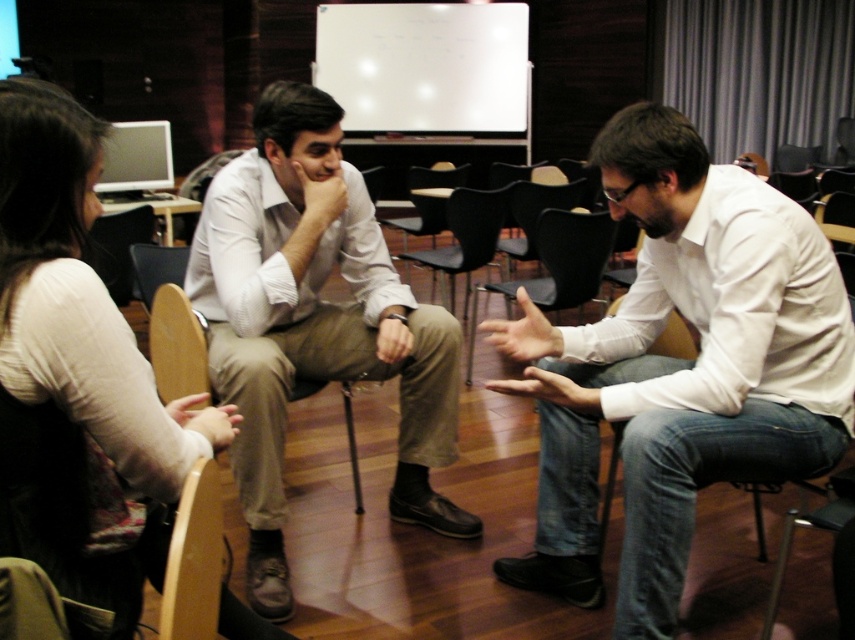
You are a photographer positioned behind the group. You want to take a photo of the smooth skin hand at center without the matte white shirt at upper left blocking it. What should you do?

The matte white shirt at upper left is in front of the smooth skin hand at center. To avoid blocking the smooth skin hand at center, move your position to the side so that the matte white shirt at upper left is no longer between you and the smooth skin hand at center.